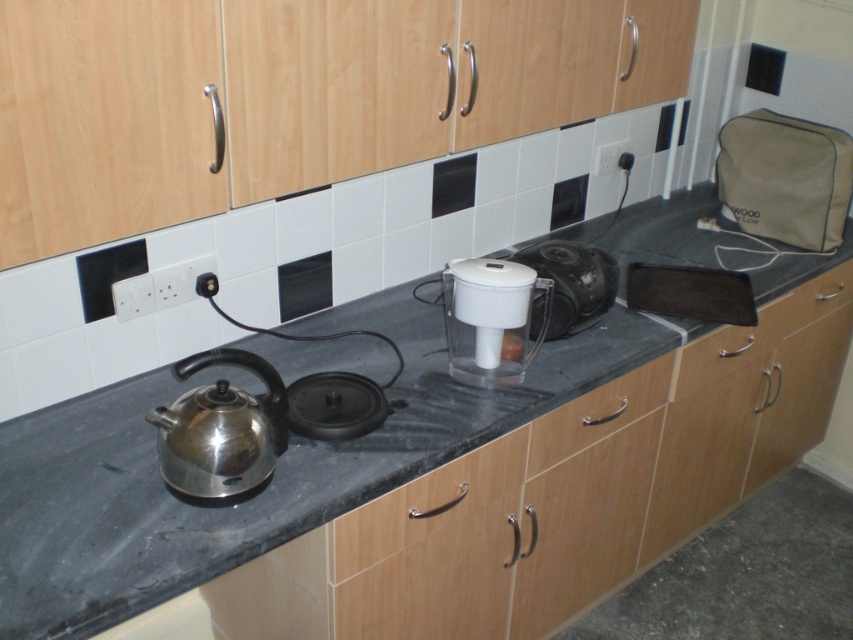
You are organizing the kitchen and need to place a new spice jar between the black granite countertop at center and the wooden drawer at center. According to the layout, where should you position the spice jar?

The black granite countertop at center is to the left of the wooden drawer at center, so you should place the spice jar between them, ensuring it is positioned to the right of the black granite countertop at center and to the left of the wooden drawer at center.

Based on the photo, you are organizing items on the kitchen counter and want to place a new spice jar. The spice jar is 10 cm tall. Which object, the white plastic water filter at center or the wooden drawer at lower right, can accommodate the spice jar in terms of vertical space?

The white plastic water filter at center has a lesser height compared to the wooden drawer at lower right, so the spice jar that is 10 cm tall can be placed on top of the white plastic water filter at center as it requires less vertical space.

What is the 2D coordinate of the black granite countertop at center?

The black granite countertop at center is located at the 2D coordinate point of (x=357, y=484).